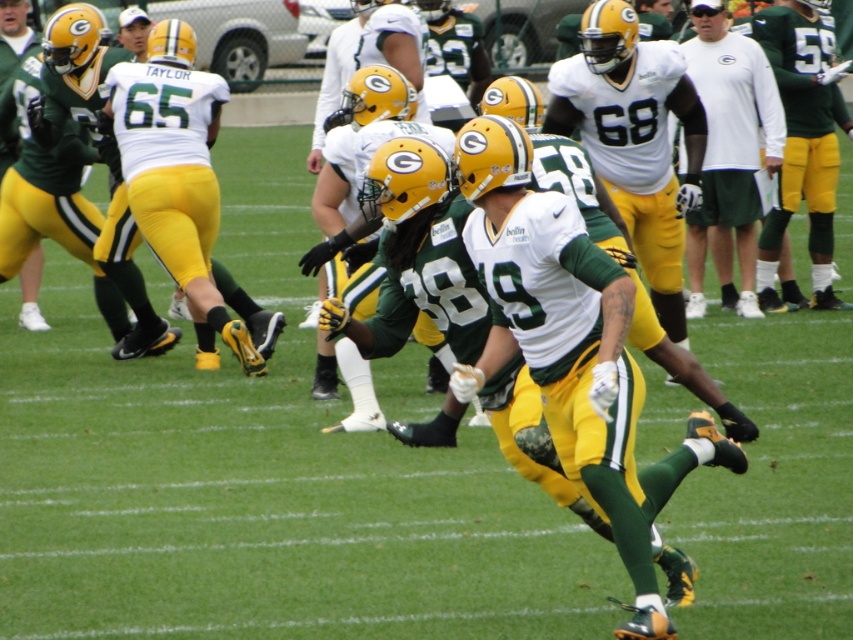
Describe the element at coordinates (634, 138) in the screenshot. I see `matte white jersey at center` at that location.

Between matte white jersey at center and white matte shirt at upper center, which one is positioned lower?

Positioned lower is matte white jersey at center.

Does point (606, 77) come in front of point (741, 284)?

Yes.

This screenshot has width=853, height=640. Find the location of `matte white jersey at center`. matte white jersey at center is located at coordinates (634, 138).